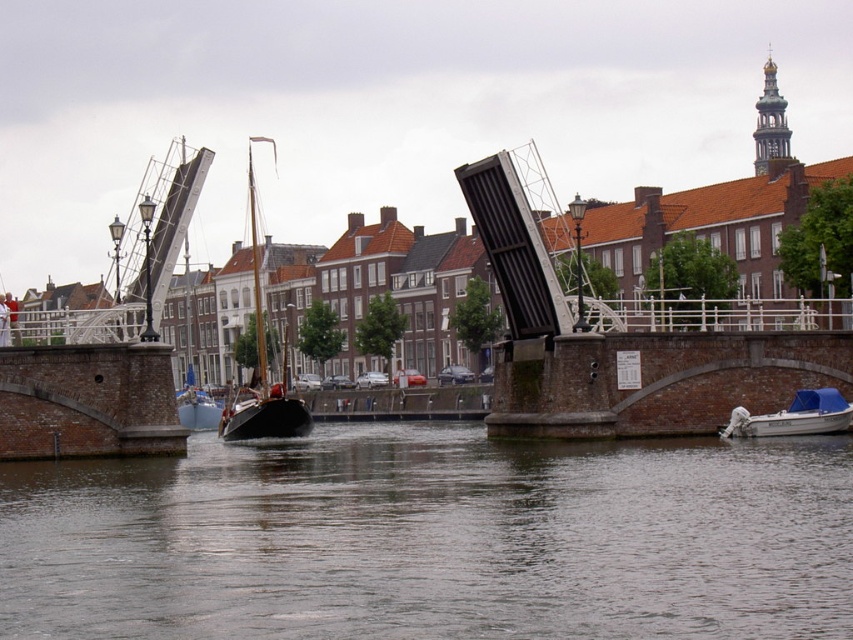
Question: Where is smooth water at center located in relation to wooden sailboat at center in the image?

Choices:
 (A) below
 (B) above

Answer: (A)

Question: Which point is farther to the camera?

Choices:
 (A) (834, 394)
 (B) (252, 218)
 (C) (506, 556)

Answer: (B)

Question: Is smooth water at center smaller than wooden sailboat at center?

Choices:
 (A) yes
 (B) no

Answer: (A)

Question: Which object appears farthest from the camera in this image?

Choices:
 (A) white plastic boat at lower right
 (B) wooden sailboat at center
 (C) smooth water at center

Answer: (B)

Question: Is wooden sailboat at center smaller than white plastic boat at lower right?

Choices:
 (A) no
 (B) yes

Answer: (A)

Question: Which is nearer to the white plastic boat at lower right?

Choices:
 (A) wooden sailboat at center
 (B) smooth water at center

Answer: (B)